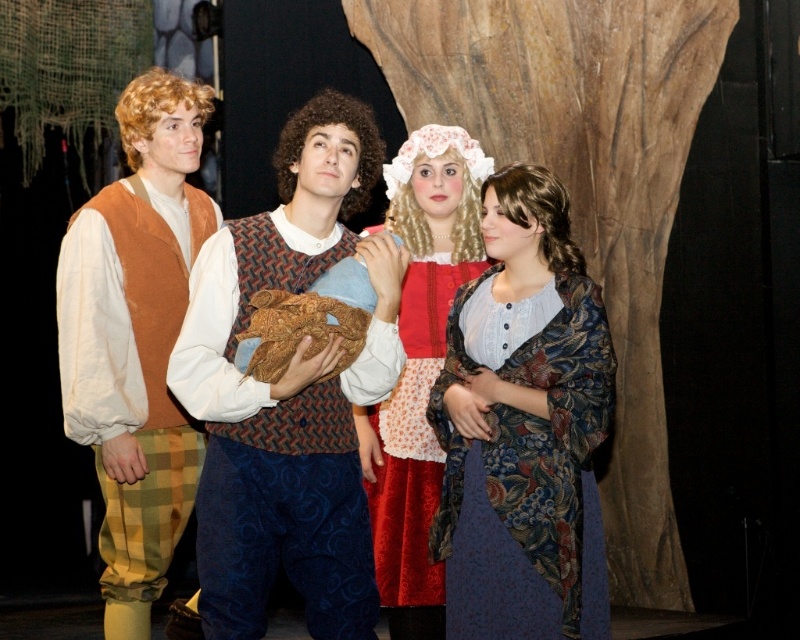
Is floral brocade shawl at center to the right of velvet red dress at center from the viewer's perspective?

Yes, floral brocade shawl at center is to the right of velvet red dress at center.

Consider the image. Measure the distance between floral brocade shawl at center and camera.

The distance of floral brocade shawl at center from camera is 12.67 feet.

Where is `floral brocade shawl at center`? The width and height of the screenshot is (800, 640). floral brocade shawl at center is located at coordinates (524, 426).

Is point (310, 138) less distant than point (436, 163)?

Yes, it is.

Is knitted wool vest at center above velvet red dress at center?

Correct, knitted wool vest at center is located above velvet red dress at center.

Where is `knitted wool vest at center`? This screenshot has height=640, width=800. knitted wool vest at center is located at coordinates (289, 392).

Locate an element on the screen. The width and height of the screenshot is (800, 640). knitted wool vest at center is located at coordinates (289, 392).

Who is more forward, [356,614] or [142,529]?

Point [356,614] is in front.

Who is more forward, (228, 400) or (120, 372)?

Point (228, 400) is in front.

Identify the location of knitted wool vest at center. (289, 392).